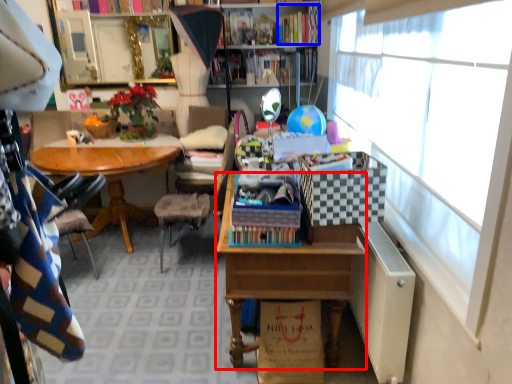
Question: Among these objects, which one is nearest to the camera, desk (highlighted by a red box) or book (highlighted by a blue box)?

Choices:
 (A) desk
 (B) book

Answer: (A)